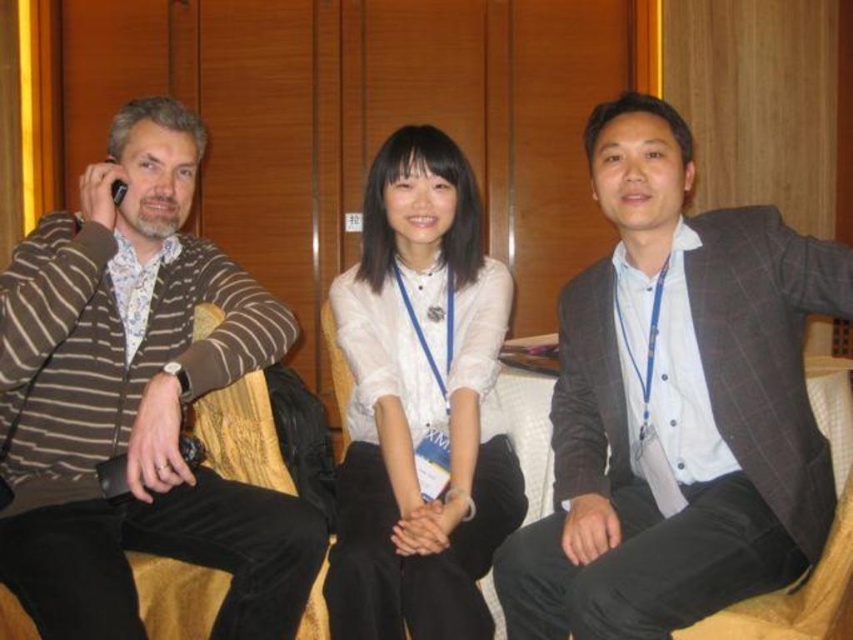
Question: Does brown striped sweater at left have a greater width compared to white matte shirt at center?

Choices:
 (A) no
 (B) yes

Answer: (B)

Question: Which object is farther from the camera taking this photo?

Choices:
 (A) brown striped sweater at left
 (B) gray checkered suit at center

Answer: (A)

Question: Is the position of gray checkered suit at center more distant than that of white matte shirt at center?

Choices:
 (A) yes
 (B) no

Answer: (B)

Question: Is gray checkered suit at center below white matte shirt at center?

Choices:
 (A) yes
 (B) no

Answer: (B)

Question: Which point is farther from the camera taking this photo?

Choices:
 (A) (512, 548)
 (B) (57, 580)

Answer: (A)

Question: Which point is closer to the camera taking this photo?

Choices:
 (A) (366, 230)
 (B) (68, 496)

Answer: (B)